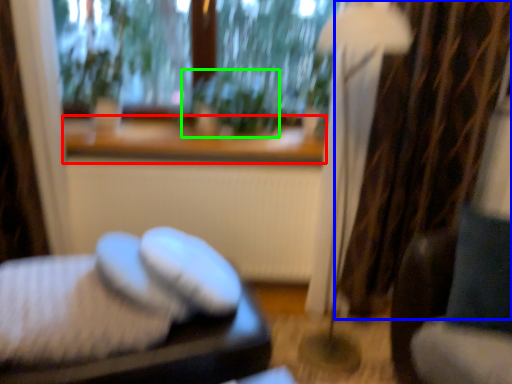
Question: Considering the real-world distances, which object is farthest from window sill (highlighted by a red box)? curtain (highlighted by a blue box) or plant (highlighted by a green box)?

Choices:
 (A) curtain
 (B) plant

Answer: (A)